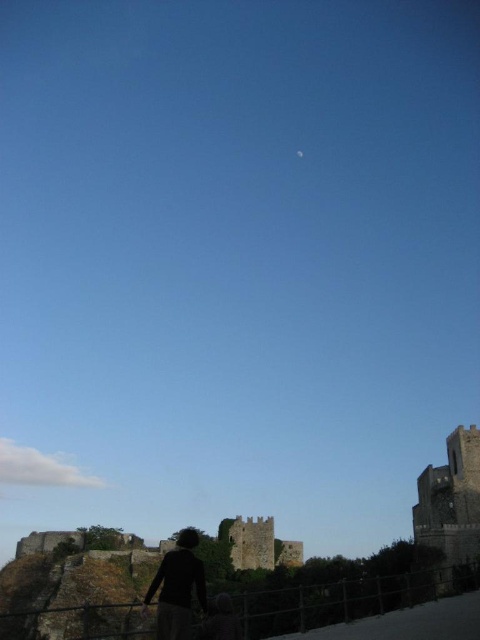
Is silhouette fabric person at lower center shorter than stone medieval tower at center?

Incorrect, silhouette fabric person at lower center's height does not fall short of stone medieval tower at center's.

Can you confirm if silhouette fabric person at lower center is positioned to the left of stone medieval tower at center?

Indeed, silhouette fabric person at lower center is positioned on the left side of stone medieval tower at center.

Locate an element on the screen. The width and height of the screenshot is (480, 640). silhouette fabric person at lower center is located at coordinates (178, 588).

This screenshot has width=480, height=640. In order to click on silhouette fabric person at lower center in this screenshot , I will do (x=178, y=588).

Is dark gray stone fort at right wider than silhouette fabric person at lower center?

No.

In the scene shown: Can you confirm if dark gray stone fort at right is thinner than silhouette fabric person at lower center?

Yes.

Is point (447, 556) positioned in front of point (184, 586)?

No, (447, 556) is further to viewer.

Locate an element on the screen. dark gray stone fort at right is located at coordinates (451, 506).

Does point (462, 454) come behind point (232, 524)?

No, it is not.

Does dark gray stone fort at right appear on the left side of stone medieval tower at center?

Incorrect, dark gray stone fort at right is not on the left side of stone medieval tower at center.

Who is more forward, (469, 499) or (245, 544)?

Point (469, 499) is in front.

I want to click on dark gray stone fort at right, so click(451, 506).